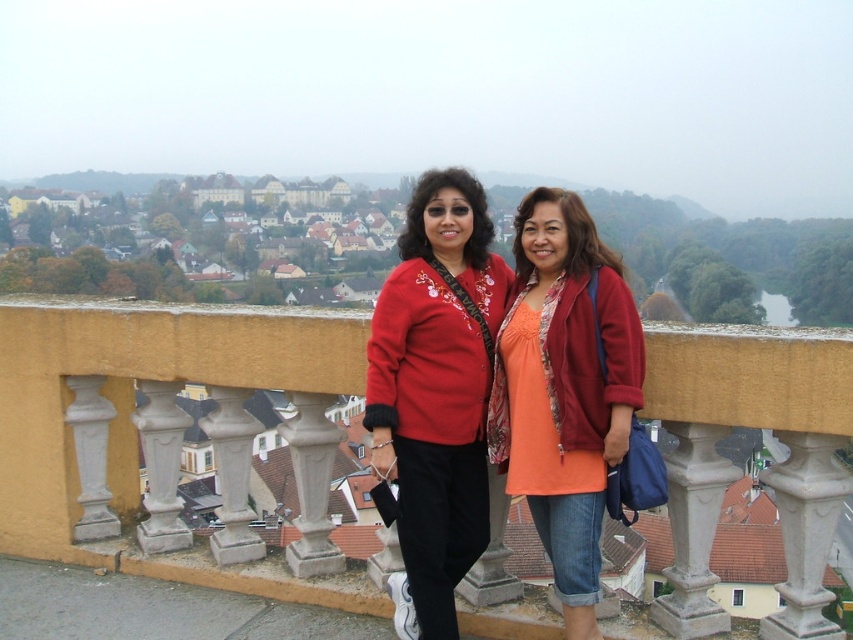
Question: Estimate the real-world distances between objects in this image. Which object is farther from the matte orange blouse at center?

Choices:
 (A) yellow stone bridge at center
 (B) matte red sweater at center

Answer: (A)

Question: Does yellow stone bridge at center have a lesser width compared to matte red sweater at center?

Choices:
 (A) no
 (B) yes

Answer: (A)

Question: Considering the relative positions of yellow stone bridge at center and matte red sweater at center in the image provided, where is yellow stone bridge at center located with respect to matte red sweater at center?

Choices:
 (A) below
 (B) above

Answer: (A)

Question: Which object is positioned closest to the yellow stone bridge at center?

Choices:
 (A) matte orange blouse at center
 (B) matte red sweater at center

Answer: (B)

Question: Which object is farther from the camera taking this photo?

Choices:
 (A) yellow stone bridge at center
 (B) matte orange blouse at center

Answer: (B)

Question: Where is yellow stone bridge at center located in relation to matte red sweater at center in the image?

Choices:
 (A) above
 (B) below

Answer: (B)